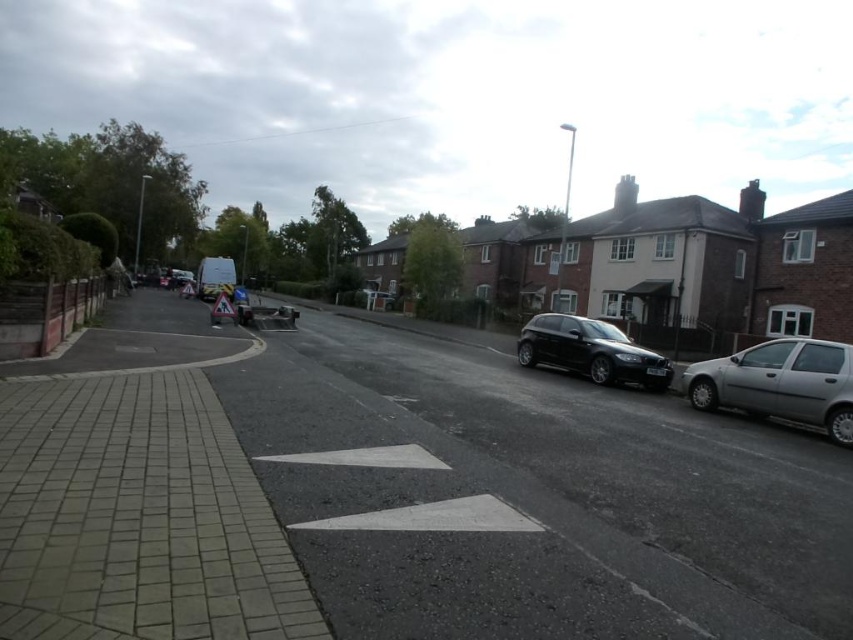
Question: Does silver metallic hatchback at right have a greater width compared to shiny black hatchback at center?

Choices:
 (A) no
 (B) yes

Answer: (A)

Question: Which point is farther from the camera taking this photo?

Choices:
 (A) (825, 368)
 (B) (645, 387)

Answer: (B)

Question: Is silver metallic hatchback at right below shiny black hatchback at center?

Choices:
 (A) no
 (B) yes

Answer: (B)

Question: Does silver metallic hatchback at right have a larger size compared to shiny black hatchback at center?

Choices:
 (A) yes
 (B) no

Answer: (B)

Question: Which point is closer to the camera taking this photo?

Choices:
 (A) (602, 349)
 (B) (839, 388)

Answer: (B)